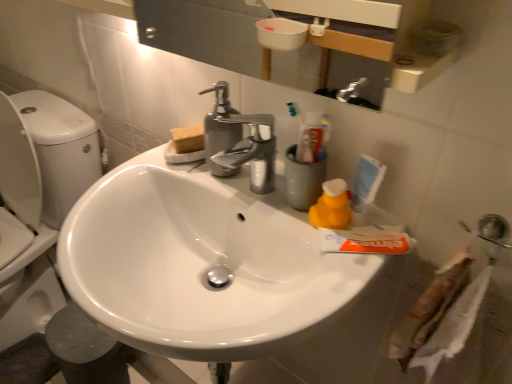
Question: Is yellow rubber duck at right beside satin nickel faucet at upper center, marked as the first plumbing fixture in a top-to-bottom arrangement?

Choices:
 (A) no
 (B) yes

Answer: (A)

Question: Is yellow rubber duck at right at the right side of satin nickel faucet at upper center, the first plumbing fixture when ordered from back to front?

Choices:
 (A) yes
 (B) no

Answer: (A)

Question: Could you tell me if yellow rubber duck at right is facing satin nickel faucet at upper center, which appears as the 2th plumbing fixture when viewed from the right?

Choices:
 (A) no
 (B) yes

Answer: (A)

Question: Would you say yellow rubber duck at right is outside satin nickel faucet at upper center, arranged as the second plumbing fixture when ordered from the bottom?

Choices:
 (A) no
 (B) yes

Answer: (B)

Question: Does yellow rubber duck at right have a smaller size compared to satin nickel faucet at upper center, marked as the first plumbing fixture in a top-to-bottom arrangement?

Choices:
 (A) yes
 (B) no

Answer: (A)

Question: From a real-world perspective, is yellow rubber duck at right positioned over satin nickel faucet at upper center, which appears as the 2th plumbing fixture when viewed from the right, based on gravity?

Choices:
 (A) no
 (B) yes

Answer: (A)

Question: From the image's perspective, would you say satin nickel faucet at upper center, arranged as the second plumbing fixture when ordered from the bottom, is positioned over metallic silver sink at lower right, the second plumbing fixture positioned from the top?

Choices:
 (A) no
 (B) yes

Answer: (B)

Question: Is satin nickel faucet at upper center, positioned as the 1th plumbing fixture in left-to-right order, wider than metallic silver sink at lower right, the 1th plumbing fixture when ordered from front to back?

Choices:
 (A) yes
 (B) no

Answer: (A)

Question: Can you confirm if satin nickel faucet at upper center, which appears as the 2th plumbing fixture when viewed from the right, is shorter than metallic silver sink at lower right, acting as the 1th plumbing fixture starting from the right?

Choices:
 (A) no
 (B) yes

Answer: (A)

Question: Does satin nickel faucet at upper center, which appears as the 2th plumbing fixture when viewed from the right, come behind metallic silver sink at lower right, the second plumbing fixture from the back?

Choices:
 (A) no
 (B) yes

Answer: (B)

Question: Can you see satin nickel faucet at upper center, placed as the 2th plumbing fixture when sorted from front to back, touching metallic silver sink at lower right, the second plumbing fixture from the back?

Choices:
 (A) no
 (B) yes

Answer: (A)

Question: Considering the relative sizes of satin nickel faucet at upper center, arranged as the second plumbing fixture when ordered from the bottom, and metallic silver sink at lower right, the second plumbing fixture from the back, in the image provided, is satin nickel faucet at upper center, arranged as the second plumbing fixture when ordered from the bottom, bigger than metallic silver sink at lower right, the second plumbing fixture from the back,?

Choices:
 (A) yes
 (B) no

Answer: (A)

Question: Does white glossy sink at center contain yellow rubber duck at right?

Choices:
 (A) yes
 (B) no

Answer: (B)